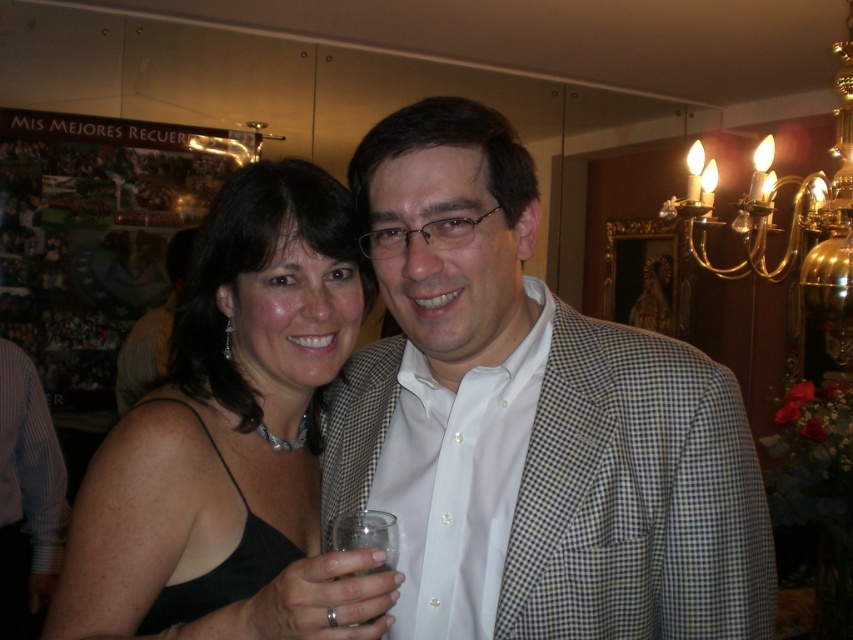
You are a photographer setting up for a group photo. You notice the matte black suit at center and the clear glass at lower center. Which object is closer to you, the photographer, so you can focus on it first?

The matte black suit at center is closer to you than the clear glass at lower center, so you should focus on the matte black suit at center first.

You are a photographer setting up for a group photo. You notice the matte black suit at center and the clear glass at lower center in your frame. Which object should you avoid placing near the edge to prevent it from being accidentally cropped out?

You should avoid placing the clear glass at lower center near the edge because it is shorter than the matte black suit at center, making it more likely to be cropped out if positioned too close to the frame edge.

You are planning to take a photo of the black satin dress at center and the blue striped shirt at left. Which one should you focus on first if you want to capture both in the same frame without moving the camera?

The black satin dress at center should be focused on first because it is shorter than the blue striped shirt at left, allowing the camera to adjust focus starting from the closer object.